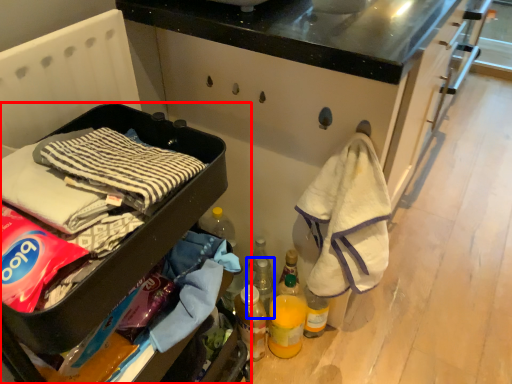
Question: Among these objects, which one is farthest to the camera, furniture (highlighted by a red box) or bottle (highlighted by a blue box)?

Choices:
 (A) furniture
 (B) bottle

Answer: (B)